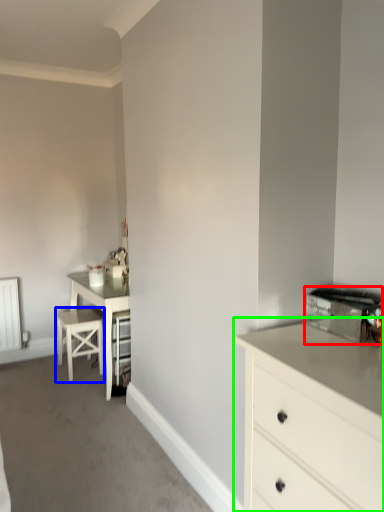
Question: Which object is positioned closest to appliance (highlighted by a red box)? Select from bar stool (highlighted by a blue box) and chest of drawers (highlighted by a green box).

Choices:
 (A) bar stool
 (B) chest of drawers

Answer: (B)